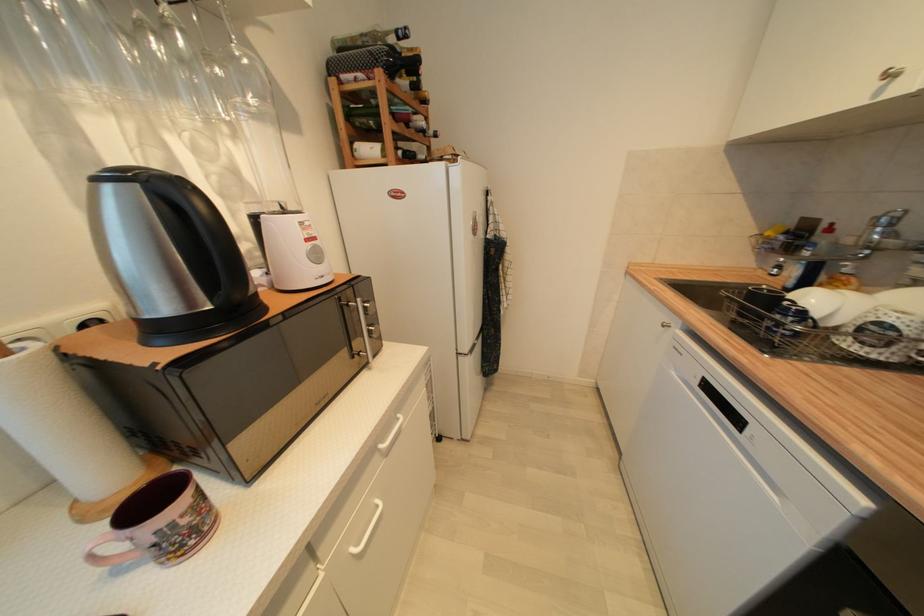
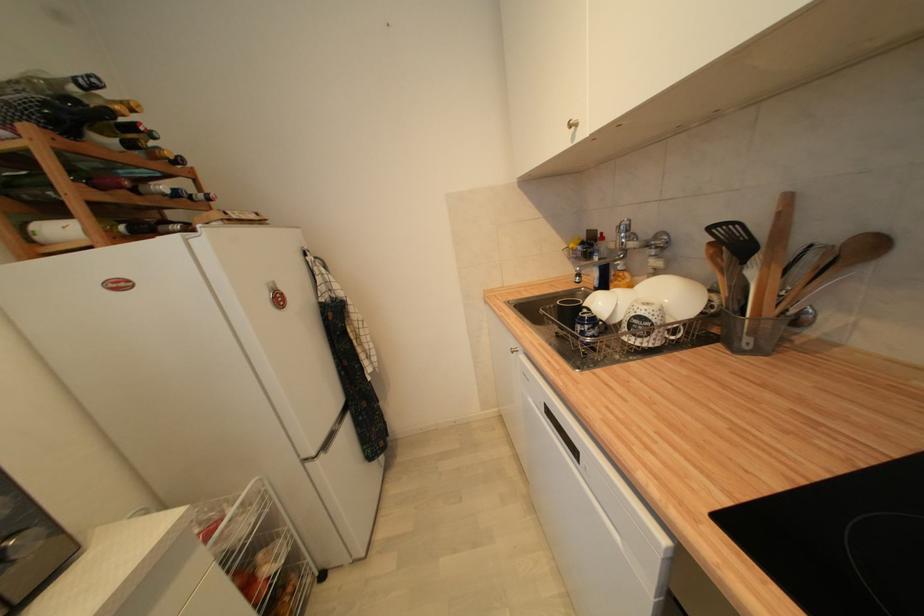
Find the pixel in the second image that matches pixel 471 354 in the first image.

(319, 456)